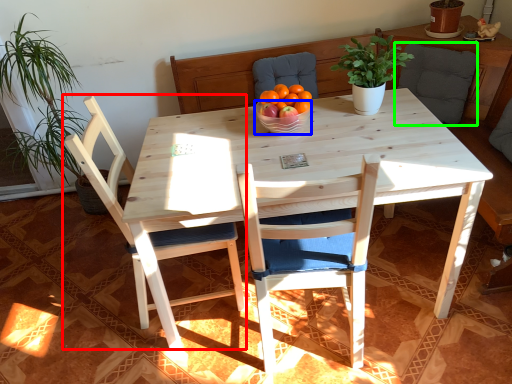
Question: Estimate the real-world distances between objects in this image. Which object is farther from chair (highlighted by a red box), bowl (highlighted by a blue box) or armchair (highlighted by a green box)?

Choices:
 (A) bowl
 (B) armchair

Answer: (B)